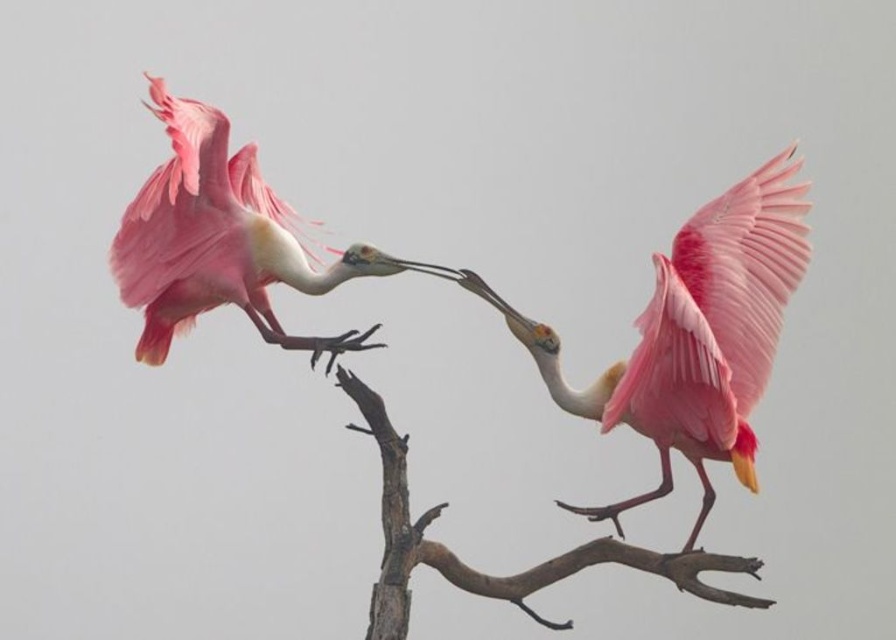
You are an ornithologist observing the scene. You notice the pink feathered spoonbill at center and the brown rough tree branch at center. Which object is closer to your line of sight?

The pink feathered spoonbill at center is closer to your line of sight because it is in front of the brown rough tree branch at center.

You are standing 5 meters away from the point at coordinates point (728, 330). Can you reach it with a 1.5 meter long stick?

The distance of point (728, 330) from camera is 3.93 meters. Since you are standing 5 meters away, the total distance to the point is 5 meters. A 1.5 meter stick is too short to reach it.

Where is the pink feathered spoonbill at center located in the image?

The pink feathered spoonbill at center is located at point [694,336].